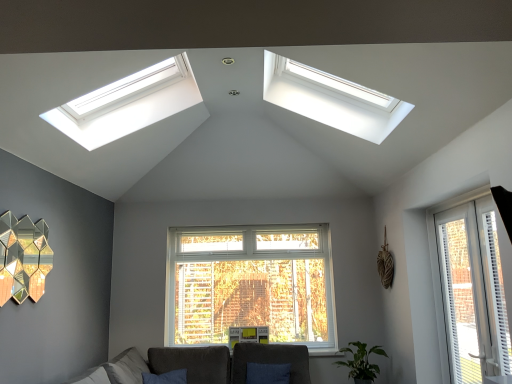
Question: Is white plastic blinds at right turned away from velvet dark gray armchair at center?

Choices:
 (A) no
 (B) yes

Answer: (A)

Question: Is white plastic blinds at right outside velvet dark gray armchair at center?

Choices:
 (A) no
 (B) yes

Answer: (B)

Question: Does white plastic blinds at right have a lesser width compared to velvet dark gray armchair at center?

Choices:
 (A) yes
 (B) no

Answer: (A)

Question: Does white plastic blinds at right lie behind velvet dark gray armchair at center?

Choices:
 (A) no
 (B) yes

Answer: (A)

Question: From a real-world perspective, is white plastic blinds at right beneath velvet dark gray armchair at center?

Choices:
 (A) no
 (B) yes

Answer: (A)

Question: Is white plastic blinds at right facing towards velvet dark gray armchair at center?

Choices:
 (A) yes
 (B) no

Answer: (B)

Question: From a real-world perspective, is velvet dark gray armchair at center beneath dark gray fabric couch at lower center?

Choices:
 (A) yes
 (B) no

Answer: (B)

Question: Is velvet dark gray armchair at center oriented away from dark gray fabric couch at lower center?

Choices:
 (A) yes
 (B) no

Answer: (A)

Question: Would you say velvet dark gray armchair at center contains dark gray fabric couch at lower center?

Choices:
 (A) yes
 (B) no

Answer: (B)

Question: Is velvet dark gray armchair at center touching dark gray fabric couch at lower center?

Choices:
 (A) yes
 (B) no

Answer: (B)

Question: From the image's perspective, is velvet dark gray armchair at center on dark gray fabric couch at lower center?

Choices:
 (A) yes
 (B) no

Answer: (A)

Question: Considering the relative positions of velvet dark gray armchair at center and dark gray fabric couch at lower center in the image provided, is velvet dark gray armchair at center to the left of dark gray fabric couch at lower center from the viewer's perspective?

Choices:
 (A) yes
 (B) no

Answer: (B)

Question: Is dark gray fabric couch at lower center wider than white plastic window at right, marked as the 2th window in a left-to-right arrangement?

Choices:
 (A) no
 (B) yes

Answer: (B)